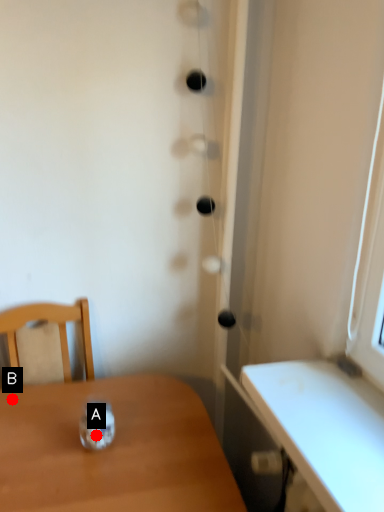
Question: Two points are circled on the image, labeled by A and B beside each circle. Which point is closer to the camera taking this photo?

Choices:
 (A) A is closer
 (B) B is closer

Answer: (A)